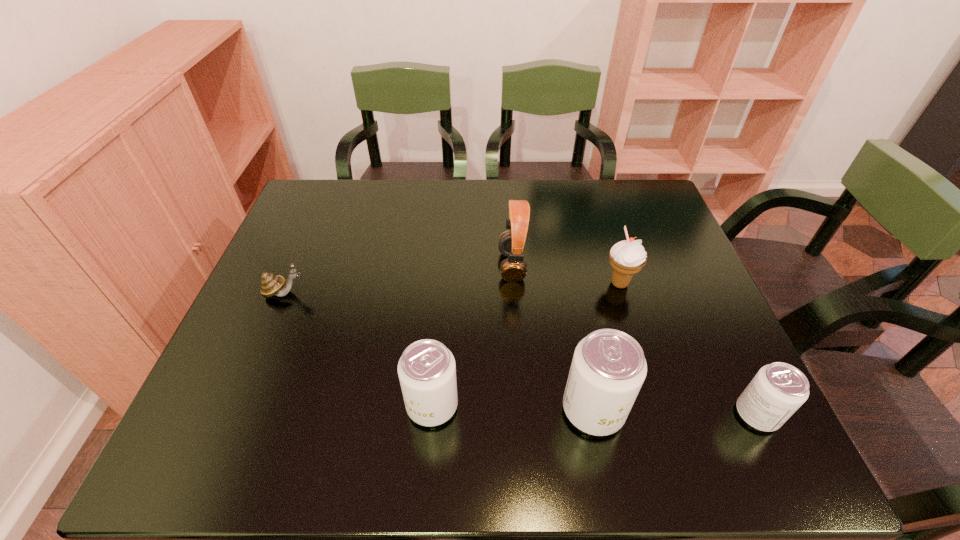
The width and height of the screenshot is (960, 540). I want to click on object situated at the near right corner, so click(777, 391).

Identify the location of vacant point at the far edge. This screenshot has width=960, height=540. click(x=494, y=221).

You are a GUI agent. You are given a task and a screenshot of the screen. Output one action in this format:
    pyautogui.click(x=<x>, y=<y>)
    Task: Click on the vacant space at the near edge of the desktop
    This screenshot has width=960, height=540.
    Given the screenshot: What is the action you would take?
    pyautogui.click(x=666, y=380)

The height and width of the screenshot is (540, 960). What are the coordinates of `vacant area at the left edge` in the screenshot? It's located at (296, 288).

The height and width of the screenshot is (540, 960). In order to click on vacant space at the right edge of the desktop in this screenshot , I will do `click(699, 306)`.

This screenshot has height=540, width=960. In order to click on vacant area that lies between the leftmost soda can and the icecream in this screenshot , I will do `click(526, 345)`.

At what (x,y) coordinates should I click in order to perform the action: click on free space between the fifth object from right to left and the second soda can from left to right. Please return your answer as a coordinate pair (x, y). Looking at the image, I should click on (513, 408).

Locate an element on the screen. The height and width of the screenshot is (540, 960). unoccupied position between the fourth object from right to left and the icecream is located at coordinates (565, 275).

Identify the location of vacant point located between the tallest soda can and the leftmost soda can. The height and width of the screenshot is (540, 960). (513, 408).

Image resolution: width=960 pixels, height=540 pixels. Identify the location of free space that is in between the shortest soda can and the snail. (521, 353).